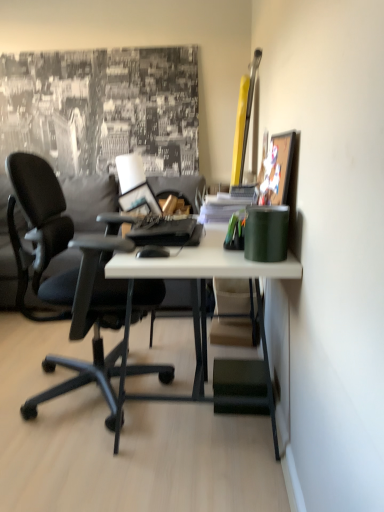
Question: Is wooden picture frame at upper right at the right side of black matte mouse at center?

Choices:
 (A) no
 (B) yes

Answer: (B)

Question: Can you confirm if wooden picture frame at upper right is thinner than black matte mouse at center?

Choices:
 (A) no
 (B) yes

Answer: (B)

Question: Is wooden picture frame at upper right oriented towards black matte mouse at center?

Choices:
 (A) no
 (B) yes

Answer: (B)

Question: Is black matte mouse at center a part of wooden picture frame at upper right?

Choices:
 (A) no
 (B) yes

Answer: (A)

Question: Can you confirm if wooden picture frame at upper right is taller than black matte mouse at center?

Choices:
 (A) no
 (B) yes

Answer: (B)

Question: From a real-world perspective, is green matte cup at right, placed as the first stationery when sorted from front to back, physically located above or below green plastic pen holder at center, the first stationery when ordered from back to front?

Choices:
 (A) below
 (B) above

Answer: (B)

Question: Relative to green plastic pen holder at center, which ranks as the second stationery in front-to-back order, is green matte cup at right, which is the 2th stationery in back-to-front order, in front or behind?

Choices:
 (A) front
 (B) behind

Answer: (A)

Question: Is green matte cup at right, placed as the first stationery when sorted from front to back, taller or shorter than green plastic pen holder at center, the first stationery when ordered from back to front?

Choices:
 (A) short
 (B) tall

Answer: (B)

Question: Is point click(x=261, y=237) positioned closer to the camera than point click(x=233, y=230)?

Choices:
 (A) closer
 (B) farther

Answer: (A)

Question: Considering the positions of point (266, 238) and point (82, 185), is point (266, 238) closer or farther from the camera than point (82, 185)?

Choices:
 (A) farther
 (B) closer

Answer: (B)

Question: Is green matte cup at right, placed as the first stationery when sorted from front to back, wider or thinner than gray fabric pillow at left?

Choices:
 (A) thin
 (B) wide

Answer: (A)

Question: From the image's perspective, is green matte cup at right, which is the 2th stationery in back-to-front order, positioned above or below gray fabric pillow at left?

Choices:
 (A) above
 (B) below

Answer: (B)

Question: From a real-world perspective, is green matte cup at right, which is the 2th stationery in back-to-front order, above or below gray fabric pillow at left?

Choices:
 (A) below
 (B) above

Answer: (B)

Question: Considering their positions, is wooden picture frame at upper right located in front of or behind satin black laptop at center?

Choices:
 (A) front
 (B) behind

Answer: (A)

Question: Based on their sizes in the image, would you say wooden picture frame at upper right is bigger or smaller than satin black laptop at center?

Choices:
 (A) small
 (B) big

Answer: (B)